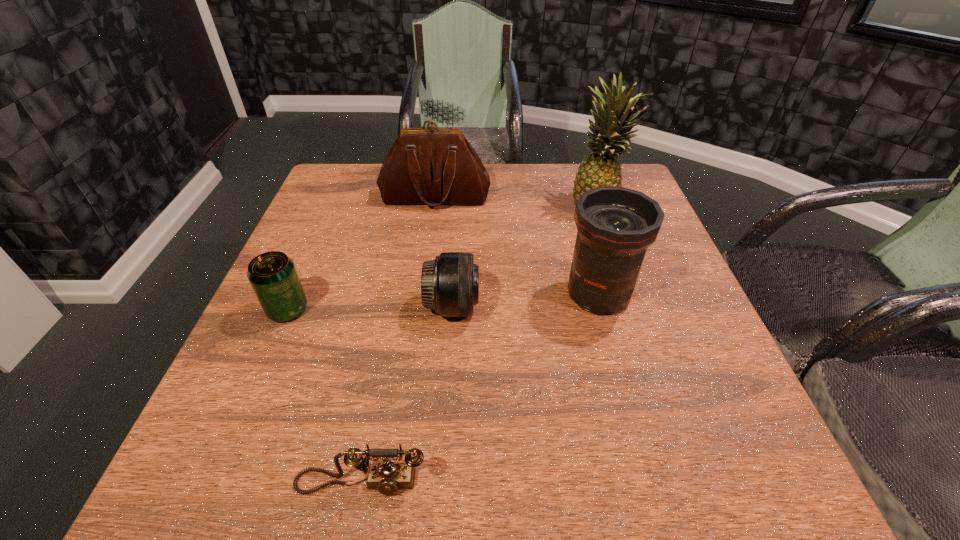
Image resolution: width=960 pixels, height=540 pixels. In the image, there is a desktop. What are the coordinates of `vacant region at the left edge` in the screenshot? It's located at (337, 230).

Find the location of a particular element. The height and width of the screenshot is (540, 960). vacant space at the right edge of the desktop is located at coordinates 687,332.

The image size is (960, 540). I want to click on vacant region between the telephone and the shoulder bag, so click(x=398, y=340).

Find the location of a particular element. vacant area that lies between the pineapple and the shoulder bag is located at coordinates (516, 201).

Find the location of a particular element. This screenshot has height=540, width=960. free space between the leftmost object and the nearest object is located at coordinates (324, 396).

At what (x,y) coordinates should I click in order to perform the action: click on free space between the beer can and the nearest object. Please return your answer as a coordinate pair (x, y). Looking at the image, I should click on (324, 396).

Where is `vacant point located between the telephone and the beer can`? The width and height of the screenshot is (960, 540). vacant point located between the telephone and the beer can is located at coordinates (324, 396).

Find the location of a particular element. The width and height of the screenshot is (960, 540). free space between the right telephoto lens and the shorter telephoto lens is located at coordinates (525, 301).

You are a GUI agent. You are given a task and a screenshot of the screen. Output one action in this format:
    pyautogui.click(x=<x>, y=<y>)
    Task: Click on the free area in between the shoulder bag and the tallest object
    The height and width of the screenshot is (540, 960).
    Given the screenshot: What is the action you would take?
    pyautogui.click(x=516, y=201)

The image size is (960, 540). Identify the location of object identified as the second closest to the beer can. (387, 477).